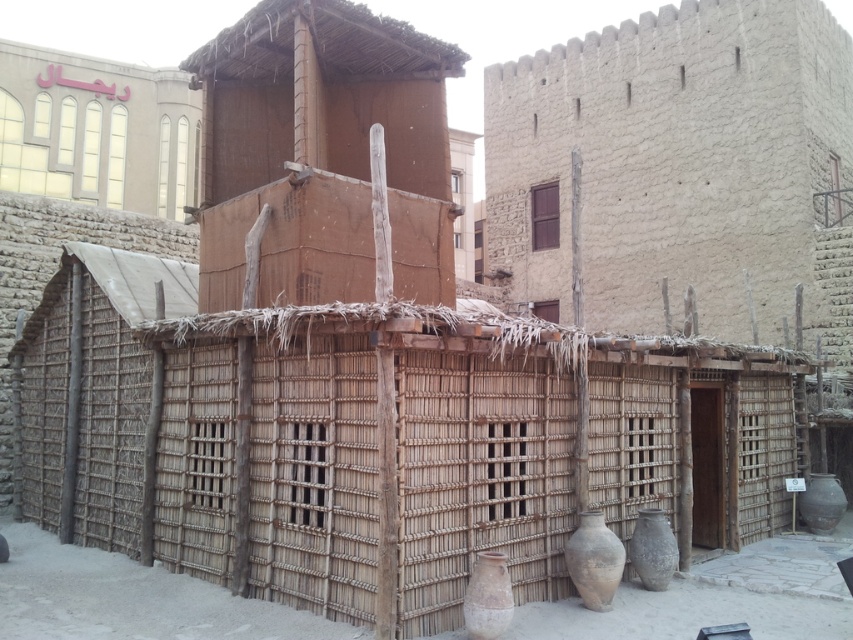
Between brown mud hut at center and earthy clay vase at center, which one is positioned lower?

Positioned lower is earthy clay vase at center.

Based on the photo, which of these two, brown mud hut at center or earthy clay vase at center, stands taller?

Standing taller between the two is earthy clay vase at center.

Who is more distant from viewer, (361, 176) or (495, 602)?

Point (361, 176)

The width and height of the screenshot is (853, 640). In order to click on brown mud hut at center in this screenshot , I will do `click(323, 154)`.

Is earthy clay vase at center in front of earthy brown clay vase at lower right?

Yes, it is.

What do you see at coordinates (488, 596) in the screenshot?
I see `earthy clay vase at center` at bounding box center [488, 596].

Is point (498, 636) less distant than point (633, 566)?

Yes, point (498, 636) is closer to viewer.

I want to click on earthy clay vase at center, so click(x=488, y=596).

Is brown thatched hut at upper center to the right of earthy brown clay vase at lower center from the viewer's perspective?

No, brown thatched hut at upper center is not to the right of earthy brown clay vase at lower center.

Is point (180, 172) farther from camera compared to point (614, 536)?

Yes, point (180, 172) is behind point (614, 536).

The image size is (853, 640). Identify the location of brown thatched hut at upper center. pyautogui.click(x=97, y=131).